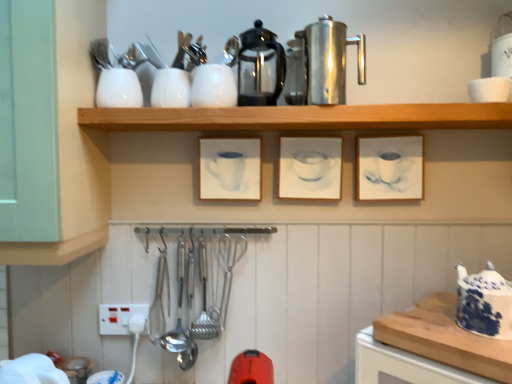
Describe the element at coordinates (310, 168) in the screenshot. I see `glossy ceramic cup at center, which is the second picture frame in left-to-right order` at that location.

What is the approximate height of matte white frame at center right, which is the 3th picture frame from left to right?

matte white frame at center right, which is the 3th picture frame from left to right, is 18.15 centimeters in height.

At what (x,y) coordinates should I click in order to perform the action: click on white matte cup at center, the third picture frame viewed from the right. Please return your answer as a coordinate pair (x, y). The width and height of the screenshot is (512, 384). Looking at the image, I should click on click(x=230, y=168).

What is the approximate width of blue and white ceramic teapot at right?

blue and white ceramic teapot at right is 5.27 inches in width.

The width and height of the screenshot is (512, 384). I want to click on white glossy vase at upper center, the second tableware viewed from the right, so click(213, 87).

Which of these two, white matte cup at center, the third picture frame viewed from the right, or matte white frame at center right, which is the 3th picture frame from left to right, stands shorter?

Standing shorter between the two is matte white frame at center right, which is the 3th picture frame from left to right.

Does white matte cup at center, the third picture frame viewed from the right, lie in front of matte white frame at center right, which is the first picture frame from right to left?

That is False.

From a real-world perspective, does white matte cup at center, which is the first picture frame in left-to-right order, sit lower than matte white frame at center right, which is the 3th picture frame from left to right?

No.

Does white matte cup at center, which is the first picture frame in left-to-right order, have a lesser width compared to matte white frame at center right, which is the first picture frame from right to left?

No, white matte cup at center, which is the first picture frame in left-to-right order, is not thinner than matte white frame at center right, which is the first picture frame from right to left.

Which is more distant, (x=281, y=123) or (x=237, y=144)?

The point (x=237, y=144) is farther.

Which of these two, wooden shelf at upper center or white matte cup at center, which is the first picture frame in left-to-right order, stands shorter?

Standing shorter between the two is wooden shelf at upper center.

Is white matte cup at center, which is the first picture frame in left-to-right order, located within wooden shelf at upper center?

No, white matte cup at center, which is the first picture frame in left-to-right order, is not a part of wooden shelf at upper center.

Is white matte cup at center, the third picture frame viewed from the right, with white glossy cup at upper left, placed as the 1th tableware when sorted from left to right?

No, white matte cup at center, the third picture frame viewed from the right, is not making contact with white glossy cup at upper left, placed as the 1th tableware when sorted from left to right.

Is point (260, 142) positioned before point (122, 100)?

No, (260, 142) is further to viewer.

Is white glossy cup at upper left, positioned as the fourth tableware in right-to-left order, at the back of white matte cup at center, which is the first picture frame in left-to-right order?

No, white glossy cup at upper left, positioned as the fourth tableware in right-to-left order, is not at the back of white matte cup at center, which is the first picture frame in left-to-right order.

Where is `picture frame that is the 3rd object located behind the white glossy cup at upper left, placed as the 1th tableware when sorted from left to right`? picture frame that is the 3rd object located behind the white glossy cup at upper left, placed as the 1th tableware when sorted from left to right is located at coordinates (230, 168).

From a real-world perspective, is white matte cup at center, the third picture frame viewed from the right, above or below wooden cutting board at lower right?

white matte cup at center, the third picture frame viewed from the right, is above wooden cutting board at lower right.

Measure the distance from white matte cup at center, the third picture frame viewed from the right, to wooden cutting board at lower right.

The distance of white matte cup at center, the third picture frame viewed from the right, from wooden cutting board at lower right is 21.93 inches.

Between white matte cup at center, the third picture frame viewed from the right, and wooden cutting board at lower right, which one is positioned behind?

white matte cup at center, the third picture frame viewed from the right.

Visually, is white matte cup at center, the third picture frame viewed from the right, positioned to the left or to the right of wooden cutting board at lower right?

Clearly, white matte cup at center, the third picture frame viewed from the right, is on the left of wooden cutting board at lower right in the image.

Can you tell me how much white matte cup at center, which is the first picture frame in left-to-right order, and white glossy bowl at upper right, the first tableware viewed from the right, differ in facing direction?

0.405 degrees separate the facing orientations of white matte cup at center, which is the first picture frame in left-to-right order, and white glossy bowl at upper right, the first tableware viewed from the right.

Considering the positions of point (206, 197) and point (483, 98), is point (206, 197) closer or farther from the camera than point (483, 98)?

Point (206, 197).

How much distance is there between white matte cup at center, which is the first picture frame in left-to-right order, and white glossy bowl at upper right, positioned as the fourth tableware in left-to-right order?

white matte cup at center, which is the first picture frame in left-to-right order, and white glossy bowl at upper right, positioned as the fourth tableware in left-to-right order, are 61.65 centimeters apart from each other.

In the image, is white matte cup at center, which is the first picture frame in left-to-right order, positioned in front of or behind white glossy bowl at upper right, positioned as the fourth tableware in left-to-right order?

Visually, white matte cup at center, which is the first picture frame in left-to-right order, is located behind white glossy bowl at upper right, positioned as the fourth tableware in left-to-right order.

From the image's perspective, which is below, blue and white ceramic teapot at right or white matte cup at center, the third picture frame viewed from the right?

blue and white ceramic teapot at right is shown below in the image.

From a real-world perspective, which picture frame is the 2nd one above the blue and white ceramic teapot at right? Please provide its 2D coordinates.

[(230, 168)]

Considering the sizes of objects blue and white ceramic teapot at right and white matte cup at center, which is the first picture frame in left-to-right order, in the image provided, who is bigger, blue and white ceramic teapot at right or white matte cup at center, which is the first picture frame in left-to-right order,?

Bigger between the two is blue and white ceramic teapot at right.

Are blue and white ceramic teapot at right and white matte cup at center, the third picture frame viewed from the right, making contact?

blue and white ceramic teapot at right and white matte cup at center, the third picture frame viewed from the right, are not in contact.

From the image's perspective, between white glossy cup at upper center, which ranks as the second tableware in left-to-right order, and matte white frame at center right, which is the 3th picture frame from left to right, who is located below?

From the image's view, matte white frame at center right, which is the 3th picture frame from left to right, is below.

Looking at this image, does white glossy cup at upper center, which ranks as the second tableware in left-to-right order, come behind matte white frame at center right, which is the 3th picture frame from left to right?

No, white glossy cup at upper center, which ranks as the second tableware in left-to-right order, is closer to the camera.

Can you tell me how much white glossy cup at upper center, marked as the 3th tableware in a right-to-left arrangement, and matte white frame at center right, which is the first picture frame from right to left, differ in facing direction?

The angle between the facing direction of white glossy cup at upper center, marked as the 3th tableware in a right-to-left arrangement, and the facing direction of matte white frame at center right, which is the first picture frame from right to left, is 2.65 degrees.

Is point (166, 104) farther from viewer compared to point (407, 192)?

No, (166, 104) is closer to viewer.

Starting from the matte white frame at center right, which is the first picture frame from right to left, which picture frame is the 2nd one behind? Please provide its 2D coordinates.

[(230, 168)]

There is a wooden shelf at upper center. Identify the location of the 2nd picture frame below it (from the image's perspective). Image resolution: width=512 pixels, height=384 pixels. (230, 168).

Considering their positions, is white glossy cup at upper left, placed as the 1th tableware when sorted from left to right, positioned further to shiny metallic coffeepot at upper right, which is counted as the first coffeepot, starting from the right, than wooden shelf at upper center?

The object further to shiny metallic coffeepot at upper right, which is counted as the first coffeepot, starting from the right, is white glossy cup at upper left, placed as the 1th tableware when sorted from left to right.

When comparing their distances from wooden shelf at upper center, does wooden cutting board at lower right or matte white frame at center right, which is the first picture frame from right to left, seem further?

wooden cutting board at lower right.

When comparing their distances from blue and white ceramic teapot at right, does wooden cutting board at lower right or shiny metallic coffeepot at upper right, which is counted as the first coffeepot, starting from the right, seem further?

shiny metallic coffeepot at upper right, which is counted as the first coffeepot, starting from the right.

Looking at this image, considering their positions, is white glossy bowl at upper right, positioned as the fourth tableware in left-to-right order, positioned closer to white glossy cup at upper center, marked as the 3th tableware in a right-to-left arrangement, than wooden shelf at upper center?

wooden shelf at upper center.

When comparing their distances from white glossy vase at upper center, the second tableware viewed from the right, does white glossy cup at upper center, marked as the 3th tableware in a right-to-left arrangement, or glossy ceramic cup at center, positioned as the 2th picture frame in right-to-left order, seem further?

Based on the image, glossy ceramic cup at center, positioned as the 2th picture frame in right-to-left order, appears to be further to white glossy vase at upper center, the second tableware viewed from the right.

Considering their positions, is shiny glass coffeepot at center, which is counted as the 1th coffeepot, starting from the left, positioned closer to matte white frame at center right, which is the 3th picture frame from left to right, than wooden shelf at upper center?

wooden shelf at upper center lies closer to matte white frame at center right, which is the 3th picture frame from left to right, than the other object.

Considering their positions, is wooden cutting board at lower right positioned further to white glossy cup at upper center, which ranks as the second tableware in left-to-right order, than matte white frame at center right, which is the first picture frame from right to left?

Based on the image, wooden cutting board at lower right appears to be further to white glossy cup at upper center, which ranks as the second tableware in left-to-right order.

From the image, which object appears to be farther from white glossy cup at upper left, positioned as the fourth tableware in right-to-left order, wooden cutting board at lower right or white glossy bowl at upper right, positioned as the fourth tableware in left-to-right order?

The object further to white glossy cup at upper left, positioned as the fourth tableware in right-to-left order, is wooden cutting board at lower right.

Image resolution: width=512 pixels, height=384 pixels. I want to click on picture frame between white glossy vase at upper center, the second tableware viewed from the right, and glossy ceramic cup at center, which is the second picture frame in left-to-right order, from left to right, so click(x=230, y=168).

Find the location of `shelf between white glossy vase at upper center, the second tableware viewed from the right, and white glossy bowl at upper right, positioned as the fourth tableware in left-to-right order`. shelf between white glossy vase at upper center, the second tableware viewed from the right, and white glossy bowl at upper right, positioned as the fourth tableware in left-to-right order is located at coordinates click(302, 117).

Identify the location of tea pot between wooden cutting board at lower right and matte white frame at center right, which is the first picture frame from right to left, along the z-axis. (484, 303).

Locate an element on the screen. The height and width of the screenshot is (384, 512). tea pot between shiny metallic coffeepot at upper right, which is counted as the first coffeepot, starting from the right, and wooden cutting board at lower right in the up-down direction is located at coordinates (484, 303).